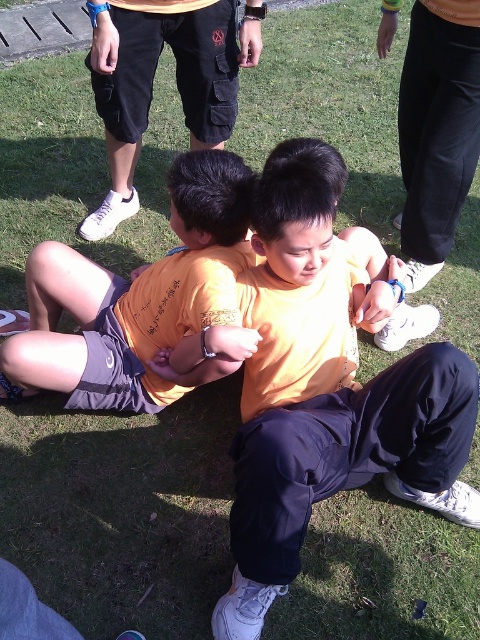
Question: Does orange matte shirt at center have a larger size compared to matte black shorts at upper center?

Choices:
 (A) no
 (B) yes

Answer: (A)

Question: Considering the relative positions of orange matte shirt at center and matte black shorts at upper center in the image provided, where is orange matte shirt at center located with respect to matte black shorts at upper center?

Choices:
 (A) left
 (B) right

Answer: (B)

Question: Which point is farther to the camera?

Choices:
 (A) orange matte shirt at center
 (B) matte black shorts at upper center

Answer: (B)

Question: Is orange matte shirt at center thinner than matte black shorts at upper center?

Choices:
 (A) yes
 (B) no

Answer: (B)